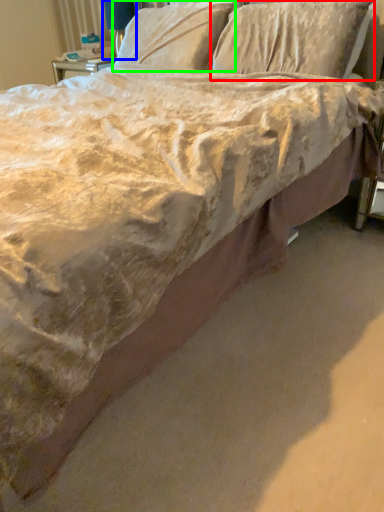
Question: Based on their relative distances, which object is nearer to pillow (highlighted by a red box)? Choose from table lamp (highlighted by a blue box) and pillow (highlighted by a green box).

Choices:
 (A) table lamp
 (B) pillow

Answer: (B)